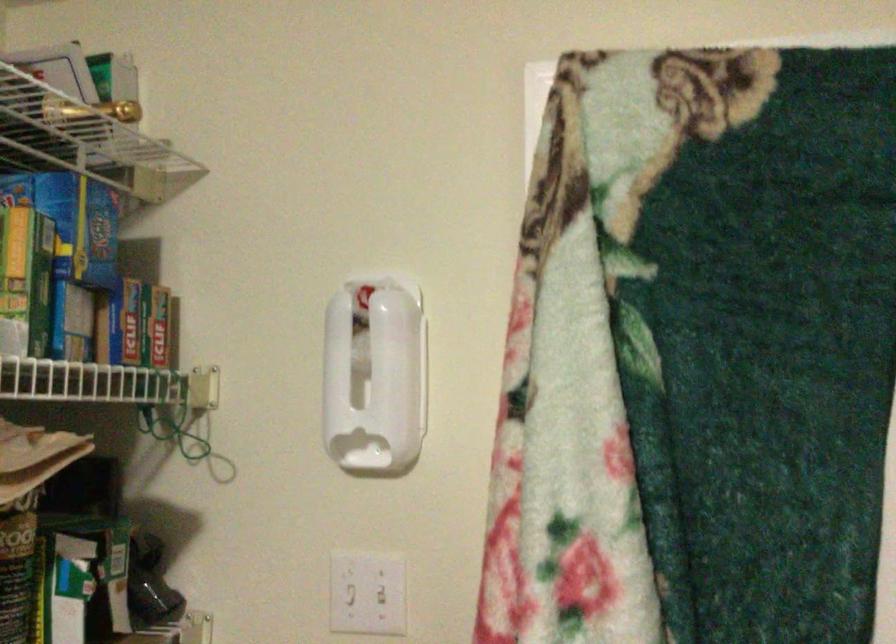
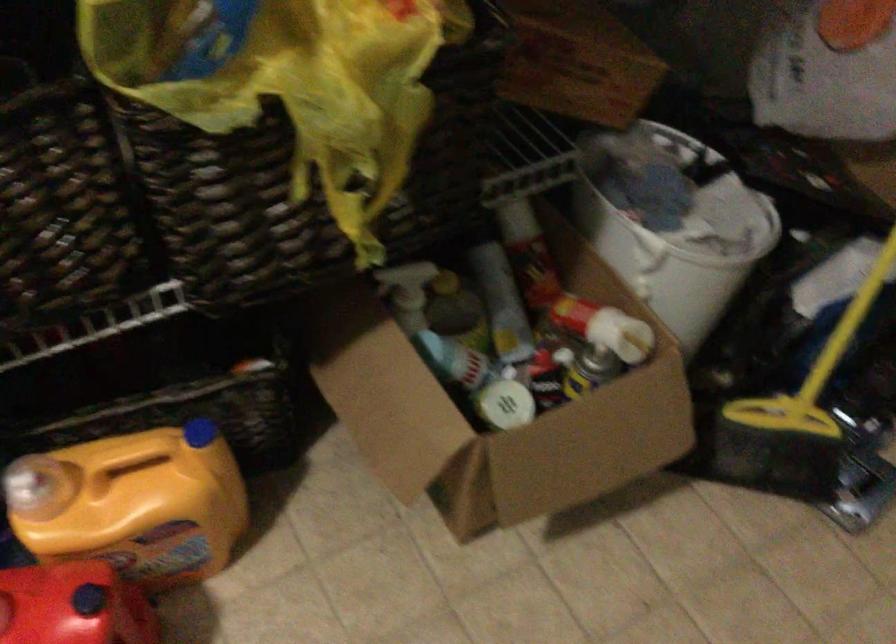
First-person continuous shooting, in which direction is the camera rotating?

The camera rotated toward left-down.